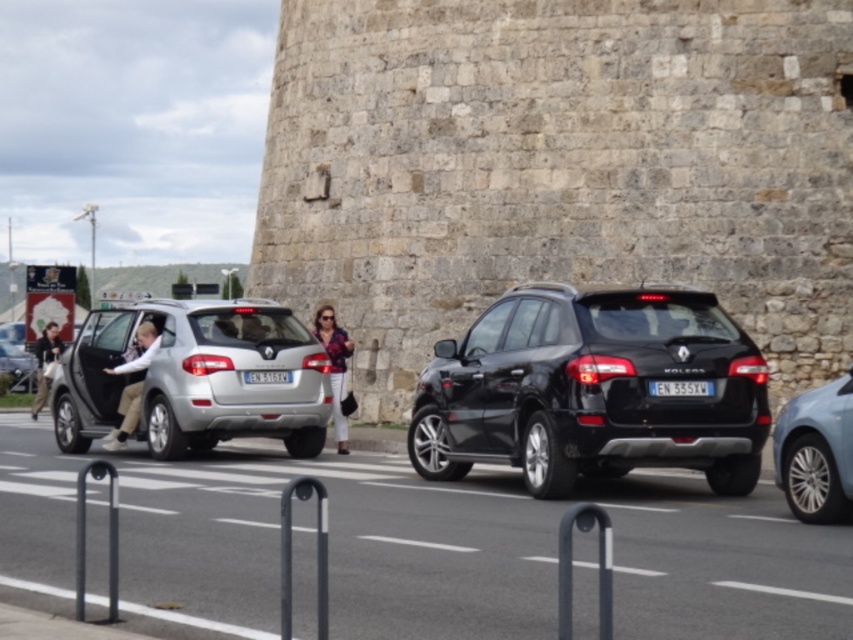
You are a delivery person trying to park your van between the black glossy suv at center and the light blue metallic sedan at right. Can you fit your van, which is 2 meters wide, in the space between them?

The black glossy suv at center is further to the viewer than the light blue metallic sedan at right, so the space between them might not be sufficient for a 2 meter wide van. You should check the actual distance before attempting to park.

You are a delivery person needing to place a package between the light blue denim jeans at left and the denim jacket at center. The package requires a minimum of 7 meters of space. Can you fit it there?

The distance between the light blue denim jeans at left and the denim jacket at center is 6.90 meters, which is slightly less than the required 7 meters. Therefore, the package cannot be placed there.

You are a delivery person who needs to place a package between the light blue denim jeans at left and the denim jacket at center. Can you fit the package there?

The light blue denim jeans at left is positioned over the denim jacket at center, so there is no space between them to place the package.